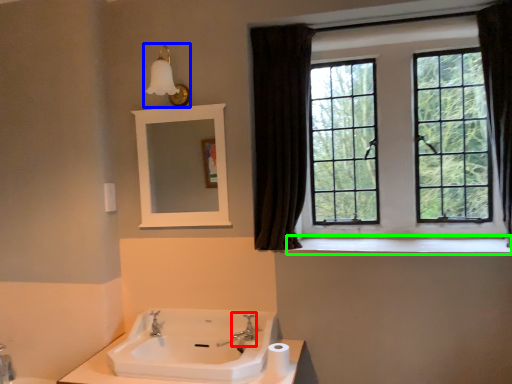
Question: Which object is the closest to the plumbing fixture (highlighted by a red box)? Choose among these: light fixture (highlighted by a blue box) or window sill (highlighted by a green box).

Choices:
 (A) light fixture
 (B) window sill

Answer: (B)